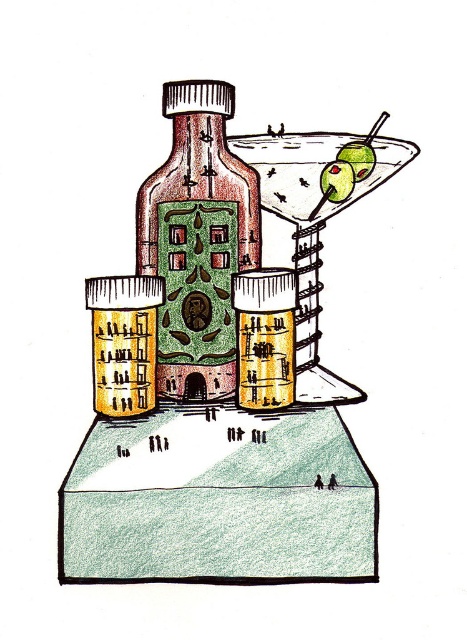
Question: Observing the image, what is the correct spatial positioning of matte glass bottle at center in reference to green matte olive at upper right?

Choices:
 (A) below
 (B) above

Answer: (A)

Question: Among these objects, which one is nearest to the camera?

Choices:
 (A) green matte olive at upper center
 (B) shiny glass martini at upper right
 (C) matte glass bottle at center
 (D) green matte olive at upper right

Answer: (B)

Question: In this image, where is shiny glass martini at upper right located relative to green matte olive at upper right?

Choices:
 (A) right
 (B) left

Answer: (B)

Question: Which of the following is the closest to the observer?

Choices:
 (A) green matte olive at upper right
 (B) shiny glass martini at upper right

Answer: (B)

Question: Which object is the closest to the shiny glass martini at upper right?

Choices:
 (A) green matte olive at upper center
 (B) matte glass bottle at center
 (C) green matte olive at upper right

Answer: (A)

Question: From the image, what is the correct spatial relationship of green matte olive at upper center in relation to green matte olive at upper right?

Choices:
 (A) right
 (B) left

Answer: (B)